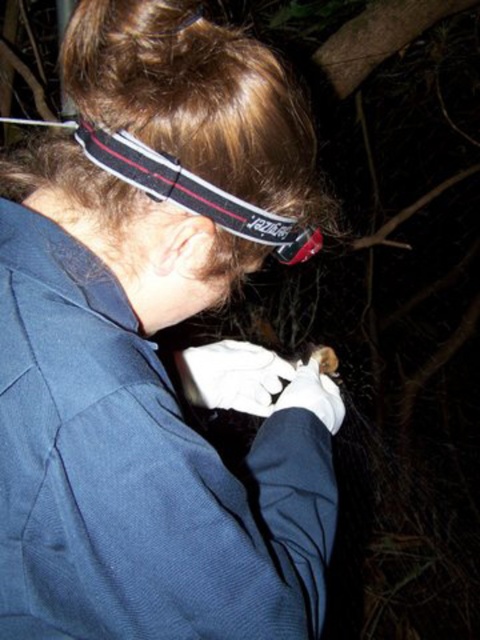
Question: Which point is farther from the camera taking this photo?

Choices:
 (A) (322, 406)
 (B) (266, 349)

Answer: (B)

Question: Which of the following is the closest to the observer?

Choices:
 (A) white cotton glove at center
 (B) dark blue fabric at center

Answer: (B)

Question: Among these objects, which one is nearest to the camera?

Choices:
 (A) white leather glove at lower center
 (B) black fabric headband at upper center

Answer: (B)

Question: Does dark blue fabric at center appear on the right side of white cotton glove at center?

Choices:
 (A) yes
 (B) no

Answer: (B)

Question: Is black fabric headband at upper center smaller than white leather glove at lower center?

Choices:
 (A) no
 (B) yes

Answer: (A)

Question: Is dark blue fabric at center smaller than black fabric headband at upper center?

Choices:
 (A) no
 (B) yes

Answer: (A)